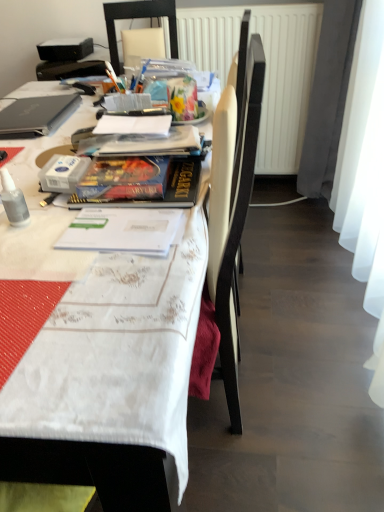
What do you see at coordinates (139, 18) in the screenshot?
I see `white plastic chair at upper center` at bounding box center [139, 18].

This screenshot has width=384, height=512. What do you see at coordinates (266, 68) in the screenshot? I see `white textured radiator at upper center` at bounding box center [266, 68].

The width and height of the screenshot is (384, 512). What do you see at coordinates (42, 214) in the screenshot? I see `white fabric table at upper left` at bounding box center [42, 214].

At what (x,y) coordinates should I click in order to perform the action: click on hardcover book at center. Please return your answer as a coordinate pair (x, y). The width and height of the screenshot is (384, 512). Looking at the image, I should click on (124, 179).

Identify the location of white plastic chair at upper center. (139, 18).

Is white textured radiator at upper center smaller than transparent plastic bottle at left?

Actually, white textured radiator at upper center might be larger than transparent plastic bottle at left.

Which is behind, point (292, 83) or point (9, 181)?

The point (292, 83) is more distant.

Considering the positions of objects white textured radiator at upper center and transparent plastic bottle at left in the image provided, who is more to the right, white textured radiator at upper center or transparent plastic bottle at left?

Positioned to the right is white textured radiator at upper center.

Does white textured radiator at upper center turn towards transparent plastic bottle at left?

Yes, white textured radiator at upper center is aimed at transparent plastic bottle at left.

Which object is wider, white fabric table at upper left or white plastic chair at upper center?

Wider between the two is white fabric table at upper left.

Could you tell me if white fabric table at upper left is turned towards white plastic chair at upper center?

No, white fabric table at upper left does not turn towards white plastic chair at upper center.

Between white fabric table at upper left and white plastic chair at upper center, which one has smaller size?

white plastic chair at upper center is smaller.

Is hardcover book at center located outside transparent plastic bottle at left?

Yes.

Between point (153, 185) and point (3, 195), which one is positioned in front?

Point (3, 195)

Consider the image. Is hardcover book at center closer to camera compared to transparent plastic bottle at left?

No, the depth of hardcover book at center is greater than that of transparent plastic bottle at left.

Does hardcover book at center have a greater height compared to transparent plastic bottle at left?

In fact, hardcover book at center may be shorter than transparent plastic bottle at left.

Image resolution: width=384 pixels, height=512 pixels. I want to click on radiator positioned vertically above the white fabric table at upper left (from a real-world perspective), so click(266, 68).

Considering the sizes of white textured radiator at upper center and white fabric table at upper left in the image, is white textured radiator at upper center bigger or smaller than white fabric table at upper left?

white textured radiator at upper center is smaller than white fabric table at upper left.

Is white textured radiator at upper center not inside white fabric table at upper left?

white textured radiator at upper center is positioned outside white fabric table at upper left.

Is white textured radiator at upper center turned away from white fabric table at upper left?

white textured radiator at upper center does not have its back to white fabric table at upper left.

From the picture: Would you say hardcover book at center is a long distance from white plastic chair at upper center?

hardcover book at center is positioned a significant distance from white plastic chair at upper center.

In the image, is hardcover book at center positioned in front of or behind white plastic chair at upper center?

hardcover book at center is in front of white plastic chair at upper center.

Can you tell me how much hardcover book at center and white plastic chair at upper center differ in facing direction?

The angle between the facing direction of hardcover book at center and the facing direction of white plastic chair at upper center is 4.37 degrees.

Is hardcover book at center not within white plastic chair at upper center?

Yes.

From the image's perspective, is hardcover book at center above or below matte black laptop at upper left?

From the image's perspective, hardcover book at center appears below matte black laptop at upper left.

Which object is more forward, hardcover book at center or matte black laptop at upper left?

Positioned in front is hardcover book at center.

Which is correct: hardcover book at center is inside matte black laptop at upper left, or outside of it?

hardcover book at center exists outside the volume of matte black laptop at upper left.

Are hardcover book at center and matte black laptop at upper left located far from each other?

Actually, hardcover book at center and matte black laptop at upper left are a little close together.

Is hardcover book at center a part of white fabric table at upper left?

That's incorrect, hardcover book at center is not inside white fabric table at upper left.

Considering the sizes of objects white fabric table at upper left and hardcover book at center in the image provided, who is shorter, white fabric table at upper left or hardcover book at center?

With less height is hardcover book at center.

Is white fabric table at upper left behind hardcover book at center?

No, it is not.

Is white fabric table at upper left turned away from hardcover book at center?

No, white fabric table at upper left is not facing the opposite direction of hardcover book at center.

You are a GUI agent. You are given a task and a screenshot of the screen. Output one action in this format:
    pyautogui.click(x=<x>, y=<y>)
    Task: Click on the radiator behind the transparent plastic bottle at left
    
    Given the screenshot: What is the action you would take?
    pyautogui.click(x=266, y=68)

Locate an element on the screen. The width and height of the screenshot is (384, 512). desk below the white plastic chair at upper center (from the image's perspective) is located at coordinates (42, 214).

When comparing their distances from matte black laptop at upper left, does white textured radiator at upper center or hardcover book at center seem closer?

hardcover book at center is positioned closer to the anchor matte black laptop at upper left.

Which object lies nearer to the anchor point white plastic chair at upper center, white textured radiator at upper center or transparent plastic bottle at left?

white textured radiator at upper center is closer to white plastic chair at upper center.

Considering their positions, is hardcover book at center positioned further to matte black laptop at upper left than white textured radiator at upper center?

Among the two, white textured radiator at upper center is located further to matte black laptop at upper left.

Looking at the image, which one is located further to white plastic chair at upper center, white fabric table at upper left or hardcover book at center?

hardcover book at center is positioned further to the anchor white plastic chair at upper center.

From the image, which object appears to be farther from white textured radiator at upper center, matte black laptop at upper left or transparent plastic bottle at left?

The object further to white textured radiator at upper center is transparent plastic bottle at left.

Which object lies nearer to the anchor point white fabric table at upper left, hardcover book at center or white textured radiator at upper center?

The object closer to white fabric table at upper left is hardcover book at center.

From the image, which object appears to be farther from matte black laptop at upper left, white fabric table at upper left or hardcover book at center?

hardcover book at center is positioned further to the anchor matte black laptop at upper left.

Which object lies nearer to the anchor point transparent plastic bottle at left, white plastic chair at upper center or white fabric table at upper left?

white fabric table at upper left is positioned closer to the anchor transparent plastic bottle at left.

At what (x,y) coordinates should I click in order to perform the action: click on paperback book between transparent plastic bottle at left and white textured radiator at upper center in the front-back direction. Please return your answer as a coordinate pair (x, y). The width and height of the screenshot is (384, 512). Looking at the image, I should click on (124, 179).

Where is `box between white fabric table at upper left and white plastic chair at upper center in the front-back direction`? The image size is (384, 512). box between white fabric table at upper left and white plastic chair at upper center in the front-back direction is located at coordinates (37, 115).

Find the location of a particular element. Image resolution: width=384 pixels, height=512 pixels. chair located between transparent plastic bottle at left and white textured radiator at upper center in the depth direction is located at coordinates (139, 18).

Identify the location of chair between matte black laptop at upper left and white textured radiator at upper center in the horizontal direction. (139, 18).